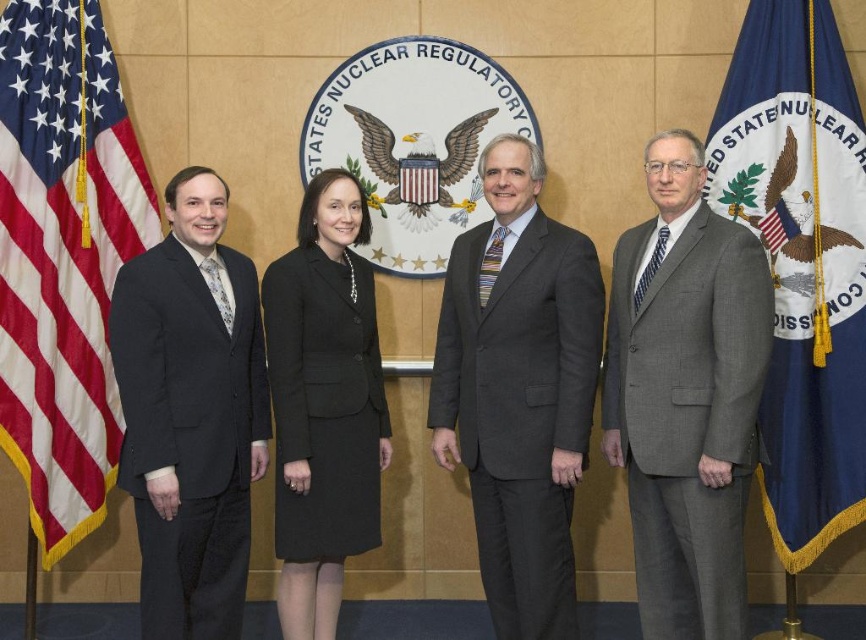
The image size is (866, 640). What do you see at coordinates (808, 208) in the screenshot? I see `silver metallic eagle at right` at bounding box center [808, 208].

Is silver metallic eagle at right closer to camera compared to gold textured eagle at center?

That is True.

This screenshot has width=866, height=640. Identify the location of silver metallic eagle at right. tap(808, 208).

Does gray wool suit at right have a larger size compared to silver metallic eagle at right?

Yes.

Which is behind, point (761, 305) or point (793, 141)?

The point (793, 141) is more distant.

The image size is (866, 640). Find the location of `gray wool suit at right`. gray wool suit at right is located at coordinates (684, 394).

Looking at this image, is american flag at left bigger than gold textured eagle at center?

Yes, american flag at left is bigger than gold textured eagle at center.

Can you confirm if american flag at left is taller than gold textured eagle at center?

Yes.

Image resolution: width=866 pixels, height=640 pixels. What do you see at coordinates (63, 257) in the screenshot? I see `american flag at left` at bounding box center [63, 257].

In order to click on american flag at left in this screenshot , I will do `click(63, 257)`.